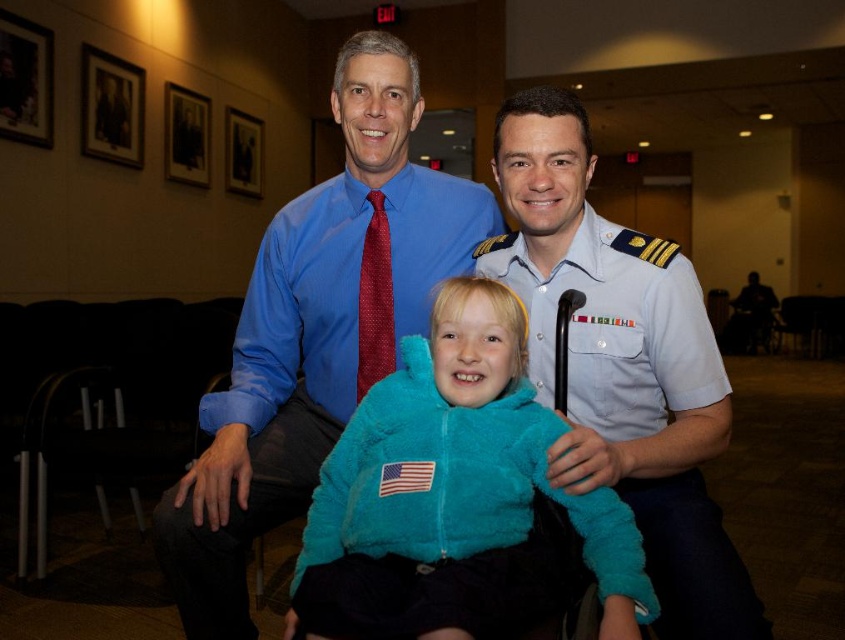
Question: Which point is farther from the camera taking this photo?

Choices:
 (A) (456, 436)
 (B) (395, 260)

Answer: (B)

Question: Is turquoise fuzzy jacket at center positioned in front of red dotted tie at center?

Choices:
 (A) yes
 (B) no

Answer: (A)

Question: Which object appears farthest from the camera in this image?

Choices:
 (A) blue shirt at center
 (B) turquoise fuzzy jacket at center
 (C) red dotted tie at center

Answer: (C)

Question: Can you confirm if blue shirt at center is smaller than turquoise fuzzy jacket at center?

Choices:
 (A) no
 (B) yes

Answer: (A)

Question: Is blue shirt at center wider than red dotted tie at center?

Choices:
 (A) no
 (B) yes

Answer: (B)

Question: Which point is farther to the camera?

Choices:
 (A) (246, 620)
 (B) (373, 432)
 (C) (508, 282)
 (D) (380, 228)

Answer: (D)